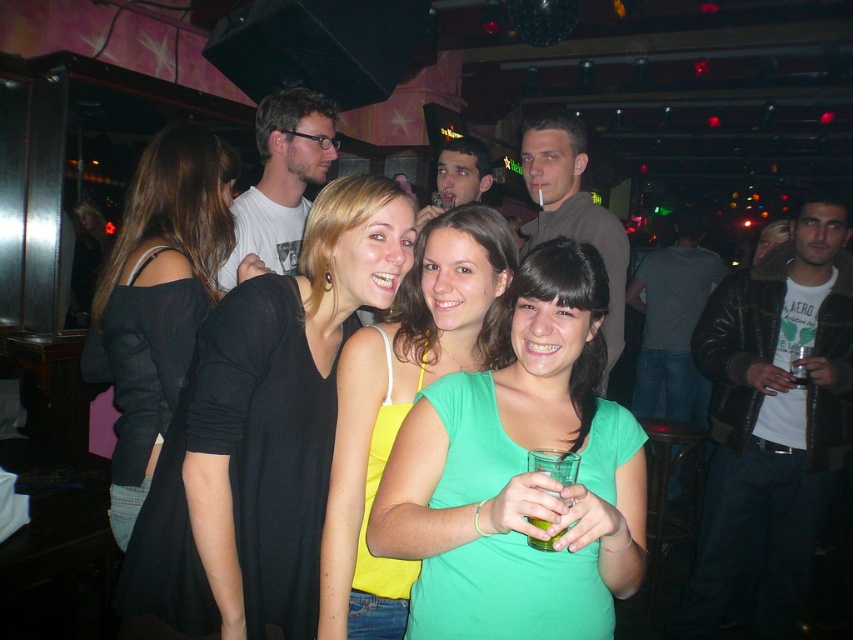
Question: Which point is farther from the camera taking this photo?

Choices:
 (A) (712, 348)
 (B) (228, 600)
 (C) (292, 150)

Answer: (A)

Question: Which of the following is the closest to the observer?

Choices:
 (A) (503, 500)
 (B) (328, 346)
 (C) (509, 266)

Answer: (A)

Question: Can you confirm if green matte shirt at center is thinner than black sheer top at left?

Choices:
 (A) no
 (B) yes

Answer: (A)

Question: Is green matte shirt at center smaller than black sheer top at left?

Choices:
 (A) yes
 (B) no

Answer: (A)

Question: Can you confirm if green matte shirt at center is positioned to the left of matte brown jacket at center?

Choices:
 (A) yes
 (B) no

Answer: (A)

Question: Which point appears closest to the camera in this image?

Choices:
 (A) (606, 536)
 (B) (450, 150)
 (C) (775, 541)
 (D) (552, 209)

Answer: (A)